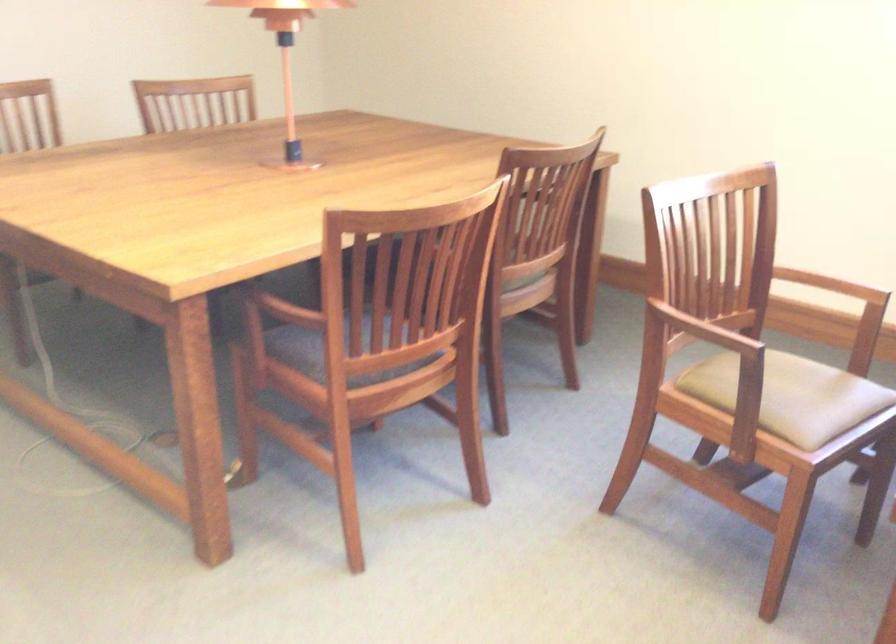
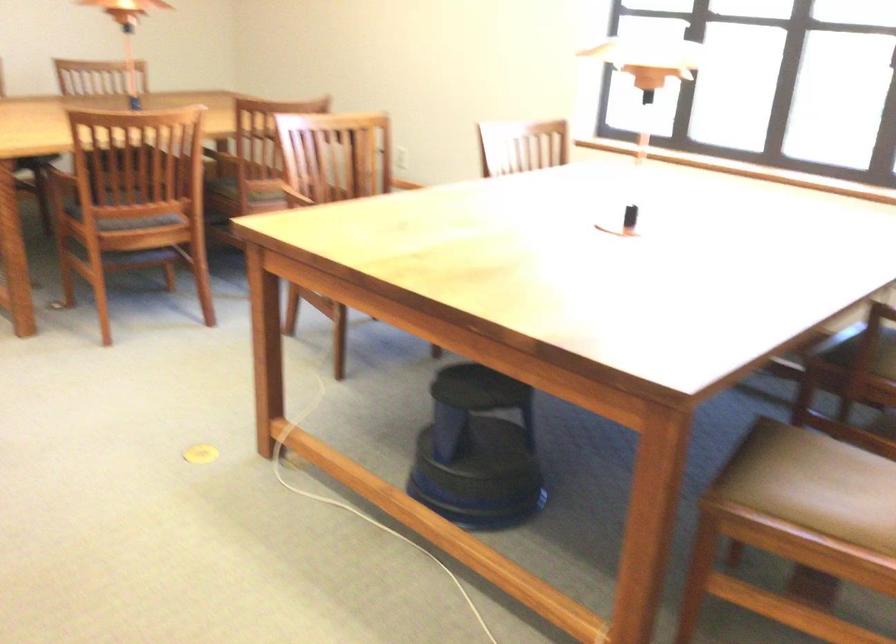
The images are taken continuously from a first-person perspective. In which direction are you moving?

The cameraman moved toward right, backward.